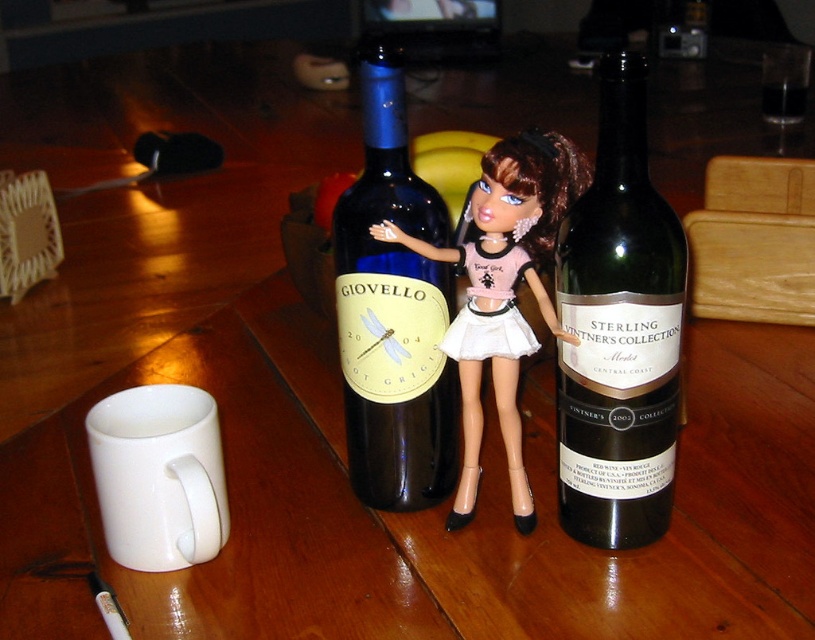
Looking at this image, does dark green glass bottle at center have a larger size compared to blue glass bottle at center?

No.

In order to click on dark green glass bottle at center in this screenshot , I will do `click(619, 332)`.

Is dark green glass bottle at center bigger than matte black doll at center?

No, dark green glass bottle at center is not bigger than matte black doll at center.

Is dark green glass bottle at center to the right of matte black doll at center from the viewer's perspective?

Indeed, dark green glass bottle at center is positioned on the right side of matte black doll at center.

Where is `dark green glass bottle at center`? dark green glass bottle at center is located at coordinates (619, 332).

Is blue glass bottle at center smaller than matte black doll at center?

Correct, blue glass bottle at center occupies less space than matte black doll at center.

Who is taller, blue glass bottle at center or matte black doll at center?

blue glass bottle at center

Locate an element on the screen. This screenshot has width=815, height=640. blue glass bottle at center is located at coordinates (394, 308).

I want to click on blue glass bottle at center, so click(394, 308).